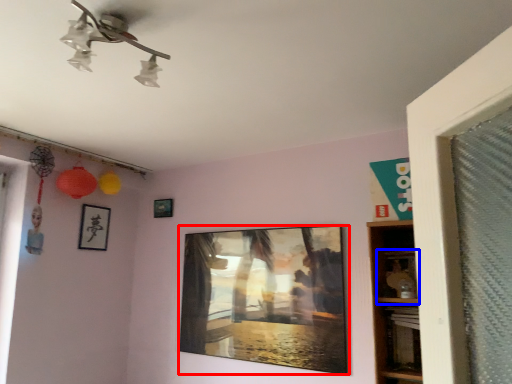
Question: Which object is closer to the camera taking this photo, picture frame (highlighted by a red box) or shelf (highlighted by a blue box)?

Choices:
 (A) picture frame
 (B) shelf

Answer: (B)